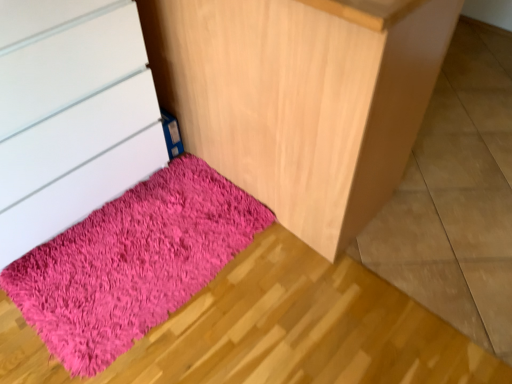
Question: Is fuzzy pink rug at lower left to the left of matte white chest of drawers at lower left from the viewer's perspective?

Choices:
 (A) yes
 (B) no

Answer: (B)

Question: Can you confirm if fuzzy pink rug at lower left is wider than matte white chest of drawers at lower left?

Choices:
 (A) yes
 (B) no

Answer: (A)

Question: Is fuzzy pink rug at lower left to the right of matte white chest of drawers at lower left from the viewer's perspective?

Choices:
 (A) no
 (B) yes

Answer: (B)

Question: Is fuzzy pink rug at lower left directly adjacent to matte white chest of drawers at lower left?

Choices:
 (A) yes
 (B) no

Answer: (B)

Question: From a real-world perspective, is fuzzy pink rug at lower left positioned under matte white chest of drawers at lower left based on gravity?

Choices:
 (A) no
 (B) yes

Answer: (A)

Question: Considering the positions of shaggy pink rug at lower left and matte white chest of drawers at lower left in the image, is shaggy pink rug at lower left taller or shorter than matte white chest of drawers at lower left?

Choices:
 (A) short
 (B) tall

Answer: (A)

Question: Which is correct: shaggy pink rug at lower left is inside matte white chest of drawers at lower left, or outside of it?

Choices:
 (A) outside
 (B) inside

Answer: (A)

Question: From the image's perspective, is shaggy pink rug at lower left above or below matte white chest of drawers at lower left?

Choices:
 (A) below
 (B) above

Answer: (A)

Question: Would you say shaggy pink rug at lower left is to the left or to the right of matte white chest of drawers at lower left in the picture?

Choices:
 (A) left
 (B) right

Answer: (B)

Question: Based on their positions, is fuzzy pink rug at lower left located to the left or right of matte white chest of drawers at lower left?

Choices:
 (A) left
 (B) right

Answer: (B)

Question: Considering the positions of fuzzy pink rug at lower left and matte white chest of drawers at lower left in the image, is fuzzy pink rug at lower left taller or shorter than matte white chest of drawers at lower left?

Choices:
 (A) short
 (B) tall

Answer: (B)

Question: Relative to matte white chest of drawers at lower left, is fuzzy pink rug at lower left in front or behind?

Choices:
 (A) behind
 (B) front

Answer: (B)

Question: Looking at their shapes, would you say fuzzy pink rug at lower left is wider or thinner than matte white chest of drawers at lower left?

Choices:
 (A) thin
 (B) wide

Answer: (B)

Question: From the image's perspective, relative to shaggy pink rug at lower left, is matte white chest of drawers at lower left above or below?

Choices:
 (A) below
 (B) above

Answer: (B)

Question: From their relative heights in the image, would you say matte white chest of drawers at lower left is taller or shorter than shaggy pink rug at lower left?

Choices:
 (A) short
 (B) tall

Answer: (B)